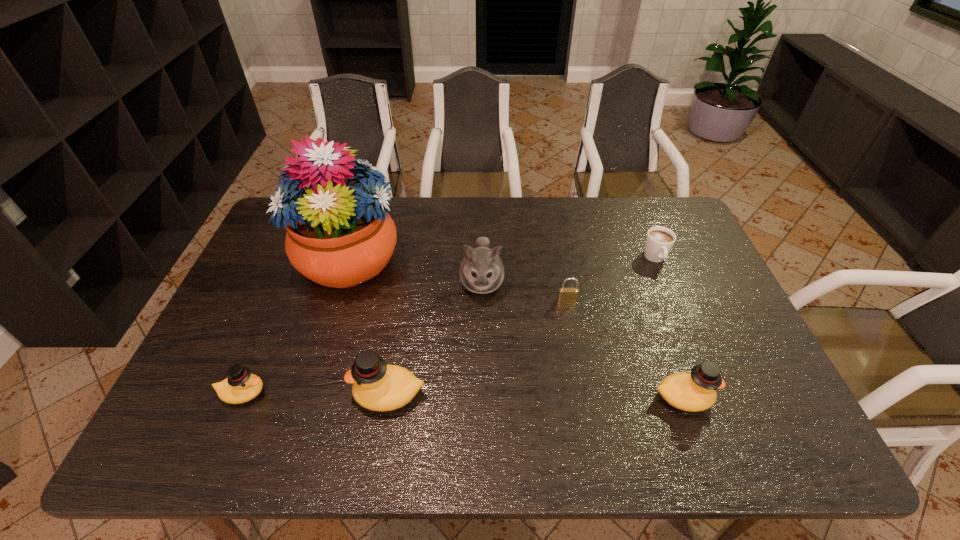
To make them evenly spaced by inserting another duck among them, please locate a free space for this new duck. Please provide its 2D coordinates. Your answer should be formatted as a tuple, i.e. [(x, y)], where the tuple contains the x and y coordinates of a point satisfying the conditions above.

[(536, 396)]